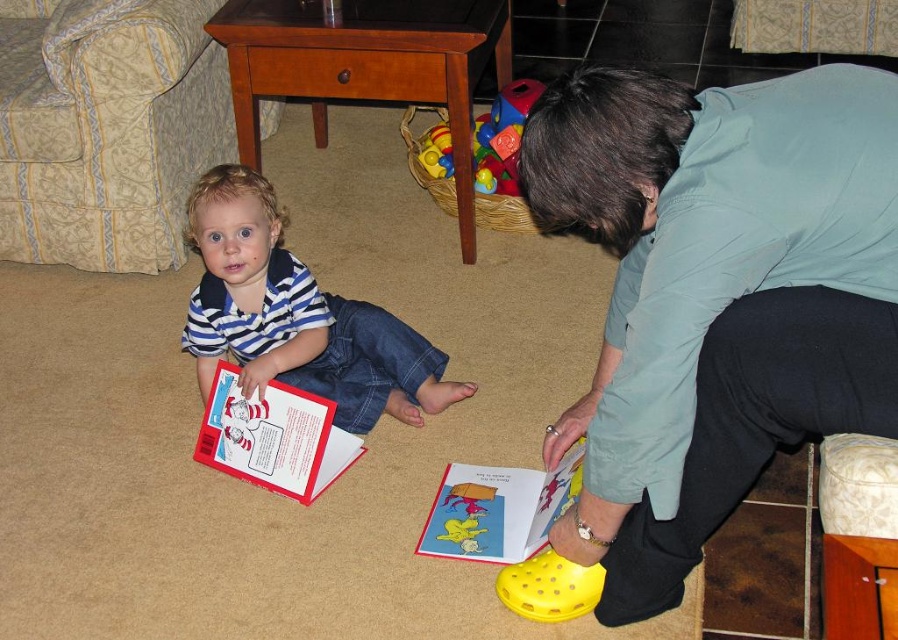
From the picture: Who is lower down, light blue shirt at lower right or rubberized plastic toy at center?

light blue shirt at lower right is lower down.

Between point (617, 317) and point (505, 180), which one is positioned behind?

The point (505, 180) is more distant.

Locate an element on the screen. light blue shirt at lower right is located at coordinates point(715,296).

Can you confirm if striped cotton shirt at center is positioned to the left of rubberized plastic toy at center?

Indeed, striped cotton shirt at center is positioned on the left side of rubberized plastic toy at center.

Consider the image. Who is positioned more to the left, striped cotton shirt at center or rubberized plastic toy at center?

Positioned to the left is striped cotton shirt at center.

Is point (212, 333) positioned in front of point (515, 102)?

Yes.

This screenshot has width=898, height=640. What are the coordinates of `striped cotton shirt at center` in the screenshot? It's located at (297, 316).

Is point (277, 296) closer to camera compared to point (212, 451)?

Yes, it is.

Based on the photo, who is shorter, striped cotton shirt at center or hardcover book at center?

Standing shorter between the two is hardcover book at center.

Locate an element on the screen. This screenshot has height=640, width=898. striped cotton shirt at center is located at coordinates coord(297,316).